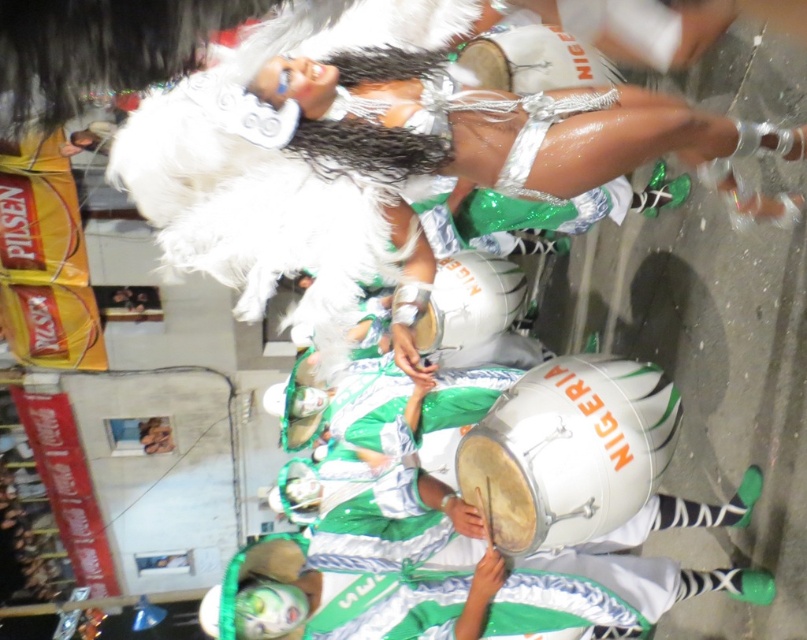
You are a photographer at the event and want to capture both the shiny silver bikini at center and the silver metallic drum at center in a single shot. Which object should you focus on first to ensure both are in frame?

The shiny silver bikini at center is positioned on the right side of the silver metallic drum at center, so you should focus on the silver metallic drum at center first to ensure both are in frame.

You are a photographer at the event and want to capture a closeup of the shiny silver bikini at center. Where should you aim your camera?

The shiny silver bikini at center is located at coordinates point (395, 120), so aim your camera there.

Consider the image. You are a photographer at the event and want to capture a clear shot of both the shiny silver bikini at center and the silver metallic drum at center. Which object should you focus on first to ensure both are in focus?

The shiny silver bikini at center is closer to the viewer than the silver metallic drum at center. To ensure both are in focus, you should focus on the shiny silver bikini at center first, as it is the closer object, and then adjust for the silver metallic drum at center.